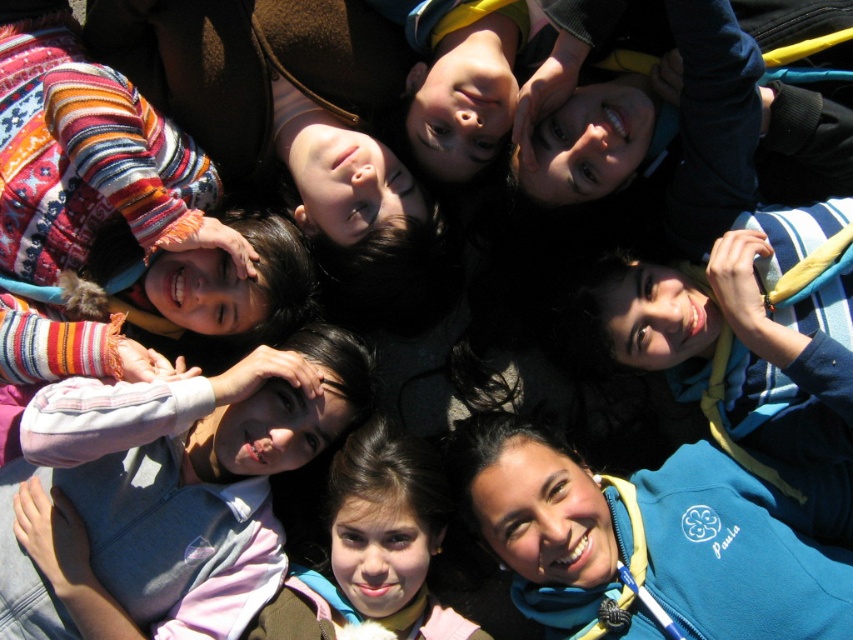
Is light blue denim jacket at center closer to the viewer compared to brown hair at center?

That is True.

Which is in front, point (264, 593) or point (412, 580)?

Point (412, 580) is more forward.

Locate an element on the screen. light blue denim jacket at center is located at coordinates (165, 493).